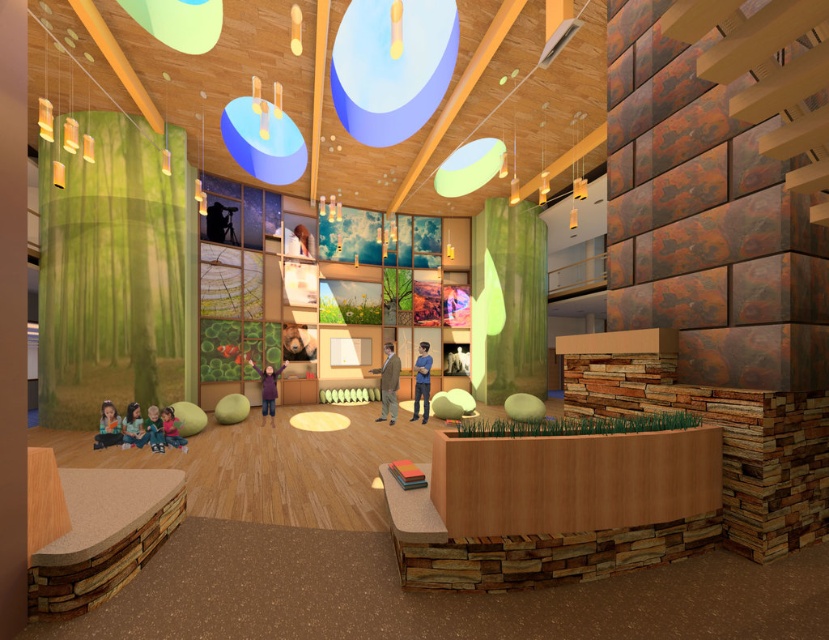
Question: Can you confirm if green matte curtain at left is positioned to the right of green glass leaf at center?

Choices:
 (A) yes
 (B) no

Answer: (B)

Question: Is green matte curtain at left above green glass leaf at center?

Choices:
 (A) no
 (B) yes

Answer: (B)

Question: Which point is farther from the camera taking this photo?

Choices:
 (A) (161, 365)
 (B) (524, 285)

Answer: (B)

Question: Does green matte curtain at left appear over green glass leaf at center?

Choices:
 (A) no
 (B) yes

Answer: (B)